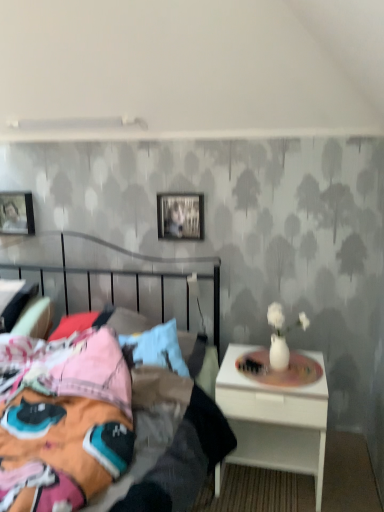
Question: From the image's perspective, is metallic silver picture frame at upper center, placed as the first picture frame when sorted from right to left, over white glossy nightstand at right?

Choices:
 (A) no
 (B) yes

Answer: (B)

Question: Can you confirm if metallic silver picture frame at upper center, the 2th picture frame in the back-to-front sequence, is wider than white glossy nightstand at right?

Choices:
 (A) yes
 (B) no

Answer: (B)

Question: Is metallic silver picture frame at upper center, the 2th picture frame viewed from the left, positioned before white glossy nightstand at right?

Choices:
 (A) yes
 (B) no

Answer: (B)

Question: Is metallic silver picture frame at upper center, the 2th picture frame viewed from the left, at the left side of white glossy nightstand at right?

Choices:
 (A) no
 (B) yes

Answer: (B)

Question: Can white glossy nightstand at right be found inside metallic silver picture frame at upper center, the 2th picture frame viewed from the left?

Choices:
 (A) no
 (B) yes

Answer: (A)

Question: In terms of height, does matte black picture frame at upper left, the 1th picture frame viewed from the left, look taller or shorter compared to white glossy nightstand at right?

Choices:
 (A) short
 (B) tall

Answer: (A)

Question: In the image, is matte black picture frame at upper left, the 1th picture frame viewed from the left, on the left side or the right side of white glossy nightstand at right?

Choices:
 (A) right
 (B) left

Answer: (B)

Question: From a real-world perspective, is matte black picture frame at upper left, marked as the 2th picture frame in a right-to-left arrangement, above or below white glossy nightstand at right?

Choices:
 (A) above
 (B) below

Answer: (A)

Question: From the image's perspective, is matte black picture frame at upper left, which appears as the 1th picture frame when viewed from the back, positioned above or below white glossy nightstand at right?

Choices:
 (A) above
 (B) below

Answer: (A)

Question: From the image's perspective, is white glossy nightstand at right positioned above or below metallic silver picture frame at upper center, arranged as the first picture frame when viewed from the front?

Choices:
 (A) above
 (B) below

Answer: (B)

Question: From a real-world perspective, is white glossy nightstand at right above or below metallic silver picture frame at upper center, the 2th picture frame in the back-to-front sequence?

Choices:
 (A) above
 (B) below

Answer: (B)

Question: Does point (301, 398) appear closer or farther from the camera than point (182, 208)?

Choices:
 (A) farther
 (B) closer

Answer: (B)

Question: Considering the positions of white glossy nightstand at right and metallic silver picture frame at upper center, placed as the first picture frame when sorted from right to left, in the image, is white glossy nightstand at right taller or shorter than metallic silver picture frame at upper center, placed as the first picture frame when sorted from right to left,?

Choices:
 (A) tall
 (B) short

Answer: (A)

Question: From their relative heights in the image, would you say metallic silver bed at center is taller or shorter than white glossy nightstand at right?

Choices:
 (A) short
 (B) tall

Answer: (B)

Question: Does point (114, 430) appear closer or farther from the camera than point (259, 435)?

Choices:
 (A) farther
 (B) closer

Answer: (B)